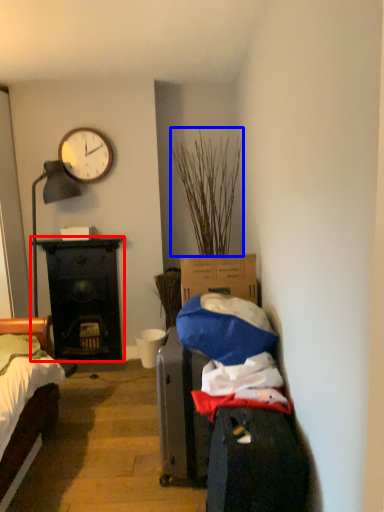
Question: Which of the following is the farthest to the observer, desk (highlighted by a red box) or plant (highlighted by a blue box)?

Choices:
 (A) desk
 (B) plant

Answer: (A)